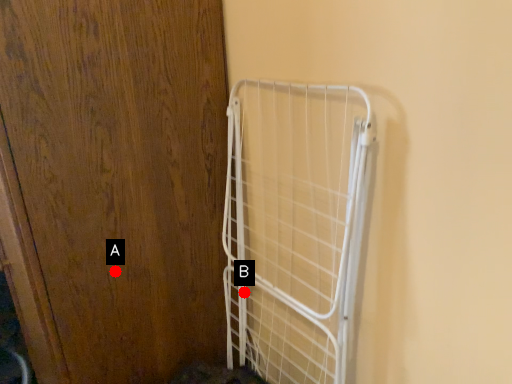
Question: Two points are circled on the image, labeled by A and B beside each circle. Which of the following is the closest to the observer?

Choices:
 (A) A is closer
 (B) B is closer

Answer: (A)